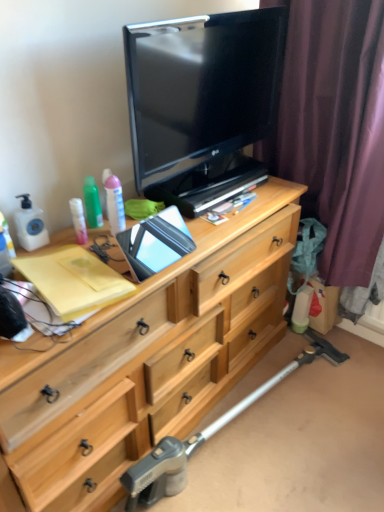
Where is `vacant space to the right of metallic silver crutch at lower center`? The width and height of the screenshot is (384, 512). vacant space to the right of metallic silver crutch at lower center is located at coordinates click(x=336, y=429).